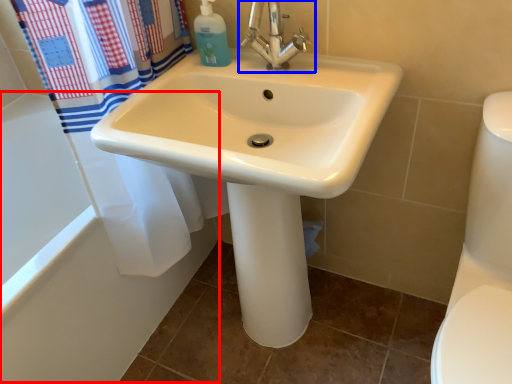
Question: Which object is closer to the camera taking this photo, bath (highlighted by a red box) or tap (highlighted by a blue box)?

Choices:
 (A) bath
 (B) tap

Answer: (B)